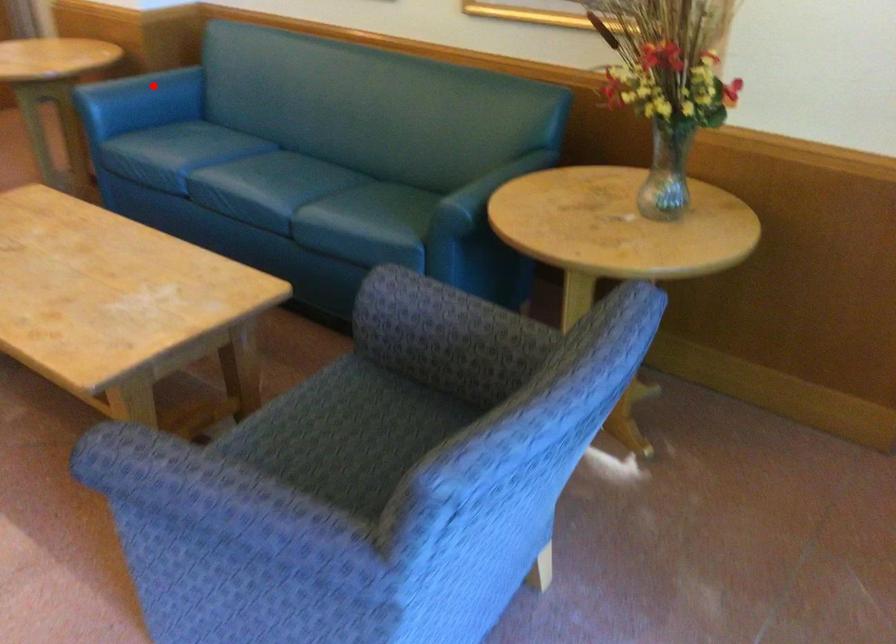
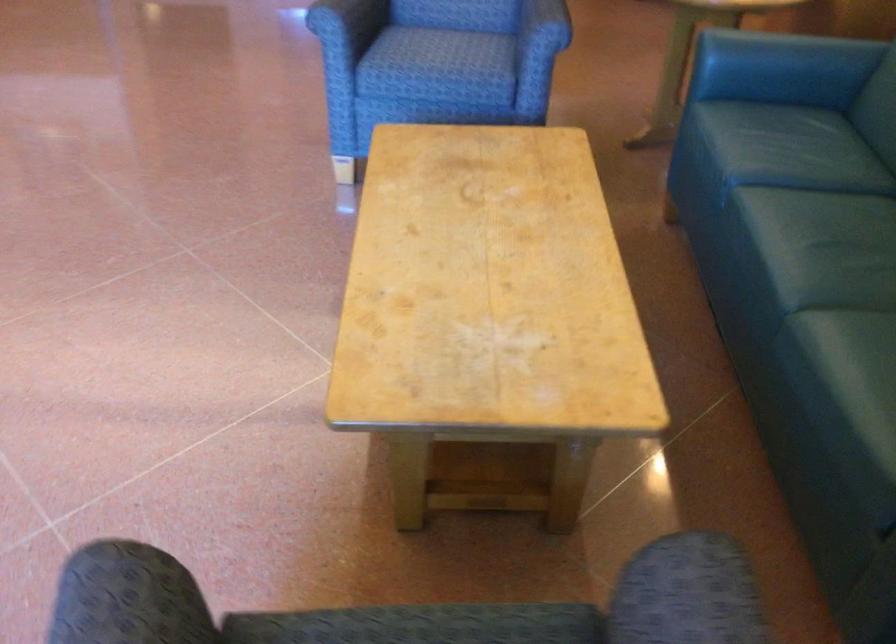
Question: I am providing you with two images of the same scene from different viewpoints. Given a red point in image1, look at the same physical point in image2. Is it:

Choices:
 (A) Closer to the viewpoint
 (B) Farther from the viewpoint

Answer: (A)